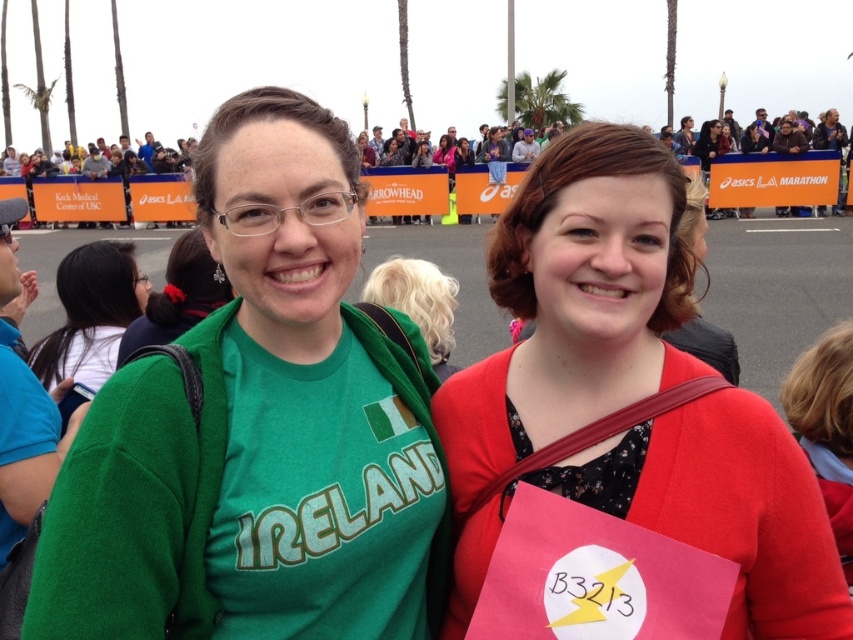
You are a photographer at the event and want to ensure both the green cotton shirt at center and the green fabric shirt at center are fully visible in your photo. Which shirt should you focus on to make sure the other is not cropped out?

You should focus on the green cotton shirt at center because it is taller than the green fabric shirt at center, so ensuring the taller shirt is fully visible will also include the shorter one in the frame.

You are a photographer trying to capture a photo of the two people in the scene. You want to ensure that both the point at point (277, 452) and the point at point (780, 611) are in focus. Given that your camera can only focus on one depth plane, which point should you focus on to maximize the chances of both points being in focus?

You should focus on point (277, 452) because it is closer to the camera than point (780, 611). This way, the point further away might still be within the depth of field, increasing the chances of both being in focus.